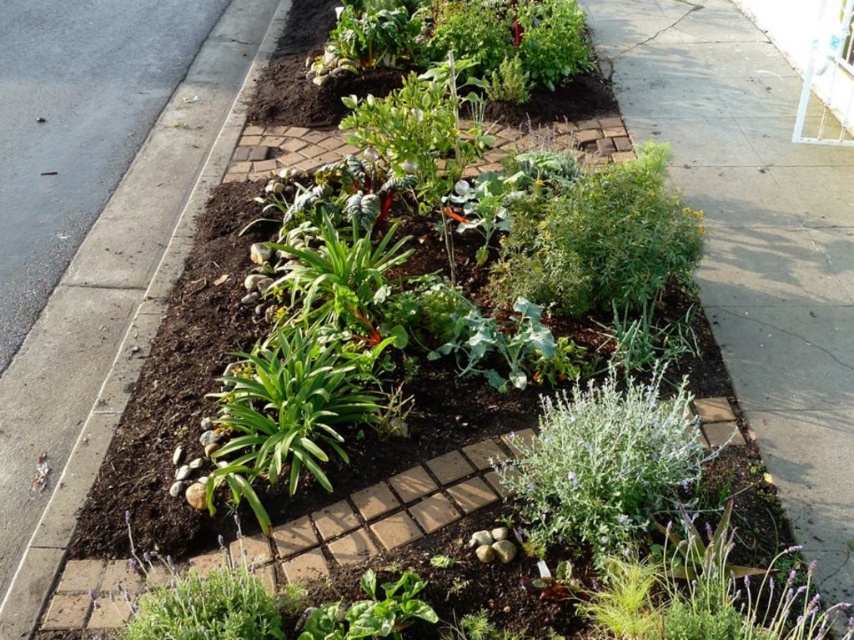
You are standing in the garden bed and want to water both the green leafy plant at lower right and the green leafy plant at center. Which plant should you water first if you want to start from the left side of the garden bed?

You should water the green leafy plant at center first because it is positioned to the left of the green leafy plant at lower right.

You are a gardener looking at the garden bed. You need to water the green leafy plant at lower right and the green leafy plant at center. Which one should you water first if you want to reach them in the order from closest to farthest from you?

You should water the green leafy plant at lower right first because it is in front of the green leafy plant at center, meaning it is closer to you.